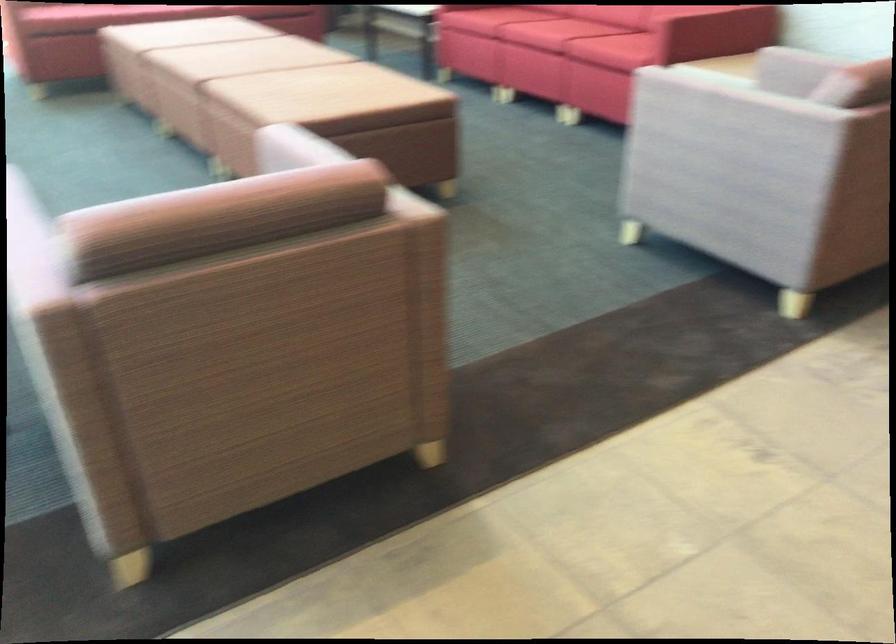
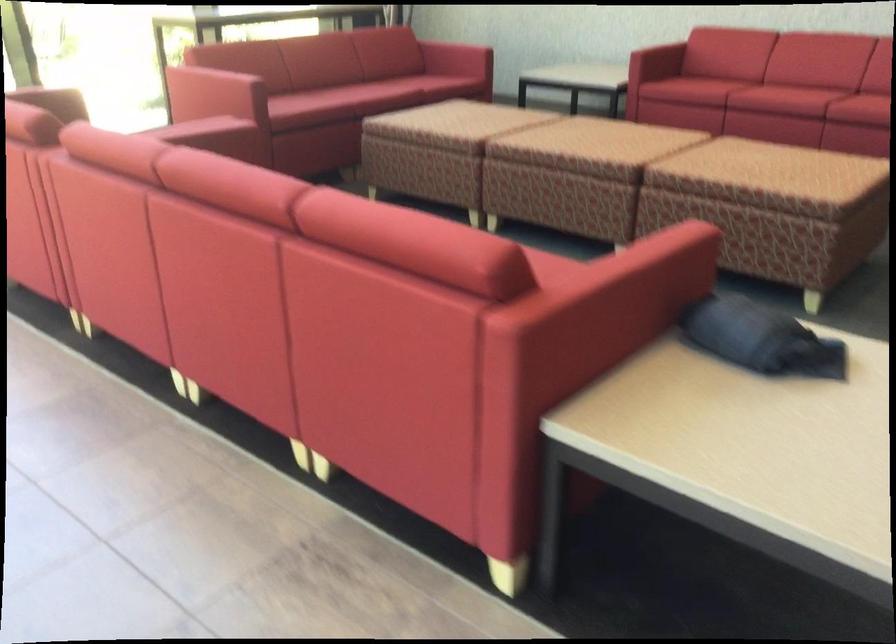
Question: In a continuous first-person perspective shot, in which direction is the camera moving?

Choices:
 (A) Left
 (B) Right
 (C) Forward
 (D) Backward

Answer: (D)